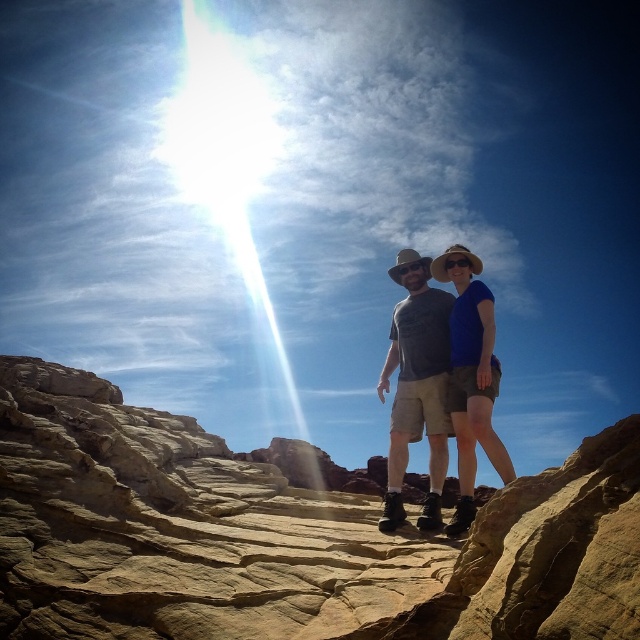
Measure the distance from matte gray shirt at center to beige woven cowboy hat at upper right.

matte gray shirt at center and beige woven cowboy hat at upper right are 58.81 feet apart from each other.

Is matte gray shirt at center bigger than beige woven cowboy hat at upper right?

Actually, matte gray shirt at center might be smaller than beige woven cowboy hat at upper right.

This screenshot has width=640, height=640. Identify the location of matte gray shirt at center. (417, 387).

Can you confirm if blue fabric shirt at center is positioned to the left of beige woven cowboy hat at upper right?

Indeed, blue fabric shirt at center is positioned on the left side of beige woven cowboy hat at upper right.

What do you see at coordinates (470, 376) in the screenshot?
I see `blue fabric shirt at center` at bounding box center [470, 376].

Who is more forward, (458, 280) or (448, 256)?

Point (448, 256)

Identify the location of blue fabric shirt at center. (470, 376).

Does point (397, 344) come farther from viewer compared to point (493, 355)?

Yes, point (397, 344) is farther from viewer.

Does matte gray shirt at center have a lesser height compared to blue fabric shirt at center?

No.

Where is `matte gray shirt at center`? matte gray shirt at center is located at coordinates (417, 387).